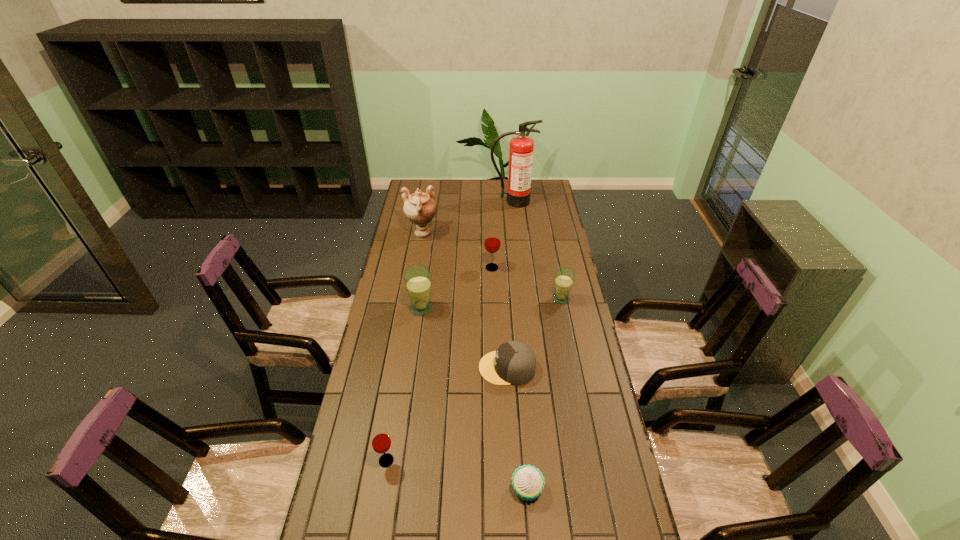
Locate an element on the screen. The image size is (960, 540). vacant area between the sixth nearest object and the seventh farthest object is located at coordinates (439, 364).

In order to click on unoccupied position between the left blue glass and the smaller red glass in this screenshot , I will do `click(404, 384)`.

Where is `vacant area that lies between the gray cap and the left red glass`? The height and width of the screenshot is (540, 960). vacant area that lies between the gray cap and the left red glass is located at coordinates (446, 414).

Identify which object is the seventh closest to the rightmost glass. Please provide its 2D coordinates. Your answer should be formatted as a tuple, i.e. [(x, y)], where the tuple contains the x and y coordinates of a point satisfying the conditions above.

[(381, 442)]

Identify which object is located as the sixth nearest to the third nearest object. Please provide its 2D coordinates. Your answer should be formatted as a tuple, i.e. [(x, y)], where the tuple contains the x and y coordinates of a point satisfying the conditions above.

[(420, 208)]

Point out which glass is positioned as the nearest to the gray cap. Please provide its 2D coordinates. Your answer should be formatted as a tuple, i.e. [(x, y)], where the tuple contains the x and y coordinates of a point satisfying the conditions above.

[(418, 279)]

The height and width of the screenshot is (540, 960). I want to click on the closest glass to the cap, so click(418, 279).

Where is `blank space that satisfies the following two spatial constraints: 1. on the back side of the nearest glass; 2. on the left side of the left blue glass`? This screenshot has width=960, height=540. blank space that satisfies the following two spatial constraints: 1. on the back side of the nearest glass; 2. on the left side of the left blue glass is located at coordinates (412, 308).

What are the coordinates of `vacant space that satisfies the following two spatial constraints: 1. on the front side of the bigger red glass; 2. on the left side of the cupcake` in the screenshot? It's located at (499, 489).

This screenshot has width=960, height=540. Identify the location of vacant point that satisfies the following two spatial constraints: 1. on the front-facing side of the rightmost glass; 2. on the left side of the tallest object. (522, 299).